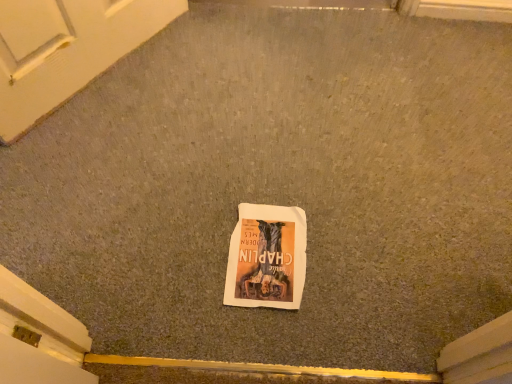
Where is `free location to the left of white paper at center`? Image resolution: width=512 pixels, height=384 pixels. free location to the left of white paper at center is located at coordinates (186, 253).